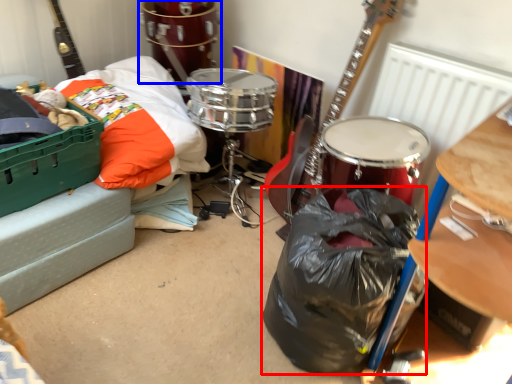
Question: Which object is further to the camera taking this photo, garbage (highlighted by a red box) or drum (highlighted by a blue box)?

Choices:
 (A) garbage
 (B) drum

Answer: (B)